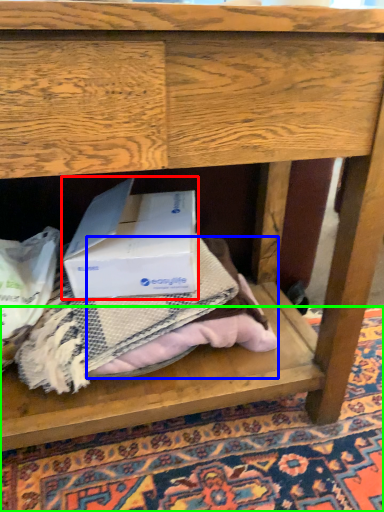
Question: Which object is the farthest from box (highlighted by a red box)? Choose among these: clothing (highlighted by a blue box) or mat (highlighted by a green box).

Choices:
 (A) clothing
 (B) mat

Answer: (B)